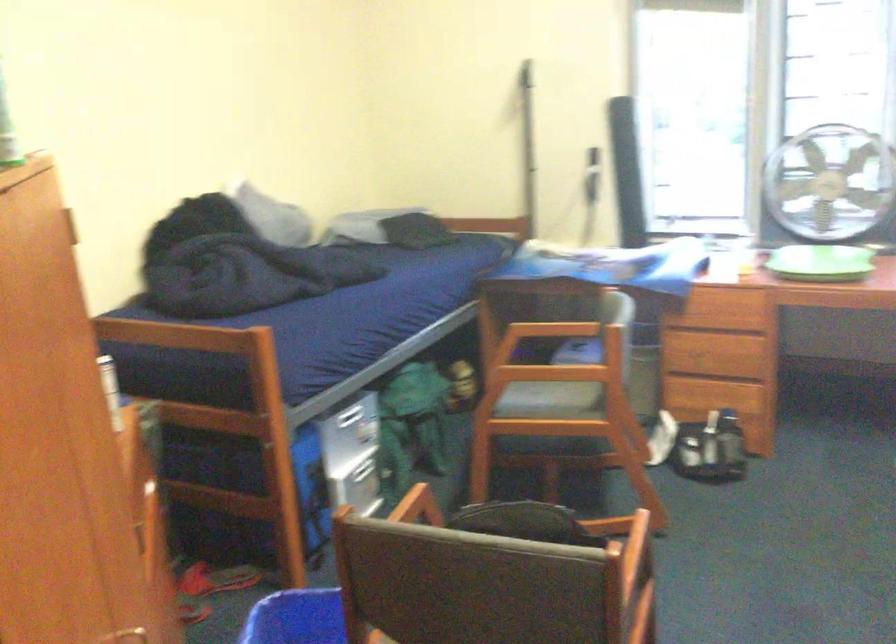
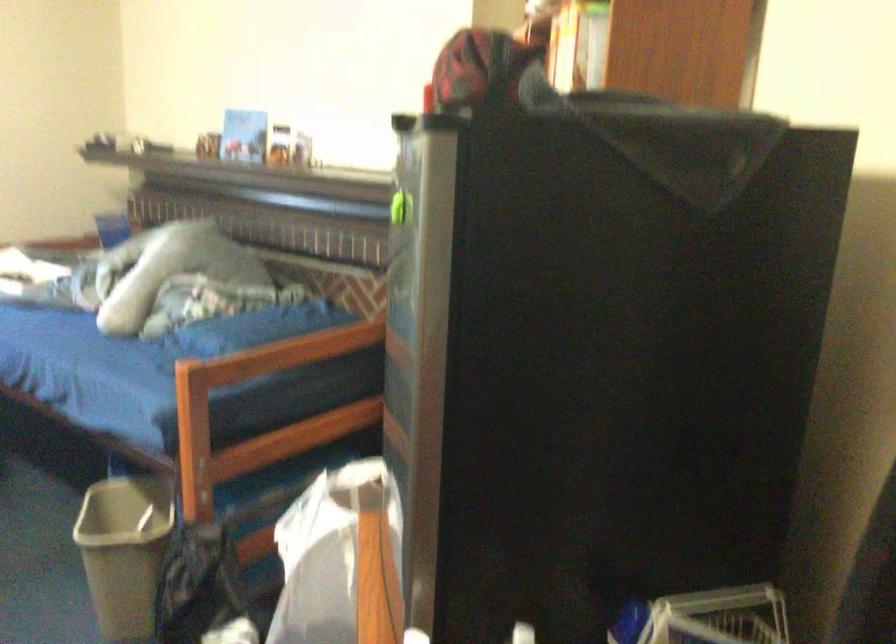
Question: The camera is either moving clockwise (left) or counter-clockwise (right) around the object. The first image is from the beginning of the video and the second image is from the end. Is the camera moving left or right when shooting the video?

Choices:
 (A) Left
 (B) Right

Answer: (A)